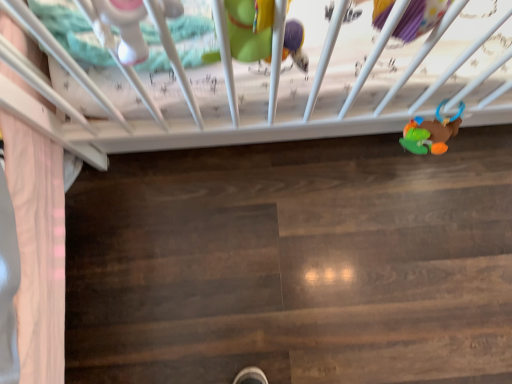
Question: Looking at their shapes, would you say matte green plush toy at upper center, which ranks as the second toy in right-to-left order, is wider or thinner than matte plastic rattle at upper left, acting as the first toy starting from the left?

Choices:
 (A) thin
 (B) wide

Answer: (A)

Question: Considering the positions of point click(243, 36) and point click(113, 4), is point click(243, 36) closer or farther from the camera than point click(113, 4)?

Choices:
 (A) farther
 (B) closer

Answer: (A)

Question: Which object is positioned closest to the rubberized plastic rattle at lower right, the 1th toy viewed from the right?

Choices:
 (A) matte green plush toy at upper center, which is the second toy from front to back
 (B) matte plastic rattle at upper left, which is the first toy in front-to-back order

Answer: (A)

Question: Estimate the real-world distances between objects in this image. Which object is closer to the matte green plush toy at upper center, which ranks as the second toy in back-to-front order?

Choices:
 (A) rubberized plastic rattle at lower right, marked as the third toy in a left-to-right arrangement
 (B) matte plastic rattle at upper left, the 3th toy in the back-to-front sequence

Answer: (B)